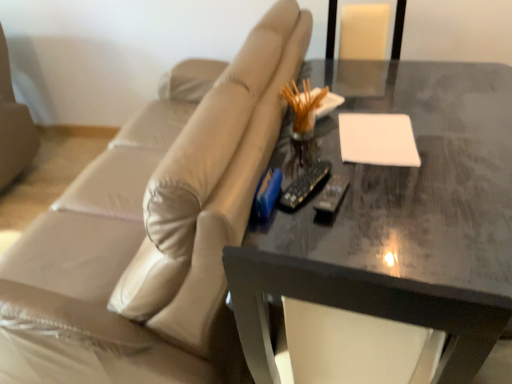
At what (x,y) coordinates should I click in order to perform the action: click on vacant point to the right of black plastic remote at center. Please return your answer as a coordinate pair (x, y). Image resolution: width=512 pixels, height=384 pixels. Looking at the image, I should click on (381, 192).